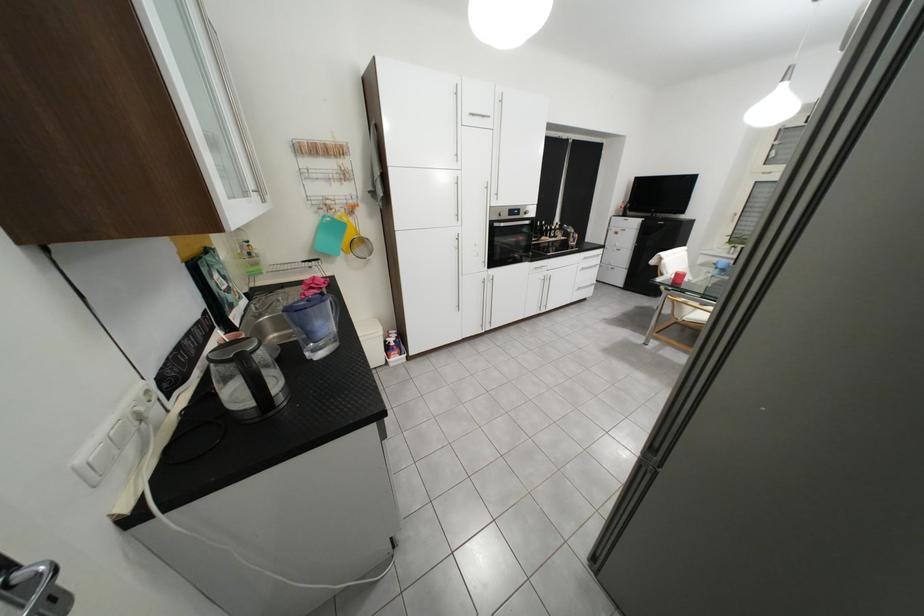
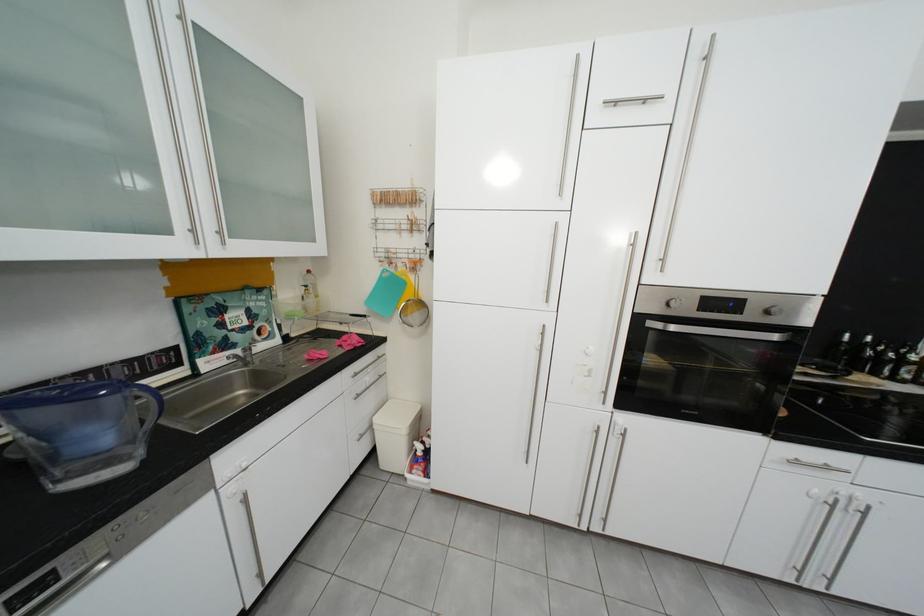
The point at (x=348, y=219) is marked in the first image. Where is the corresponding point in the second image?

(409, 275)